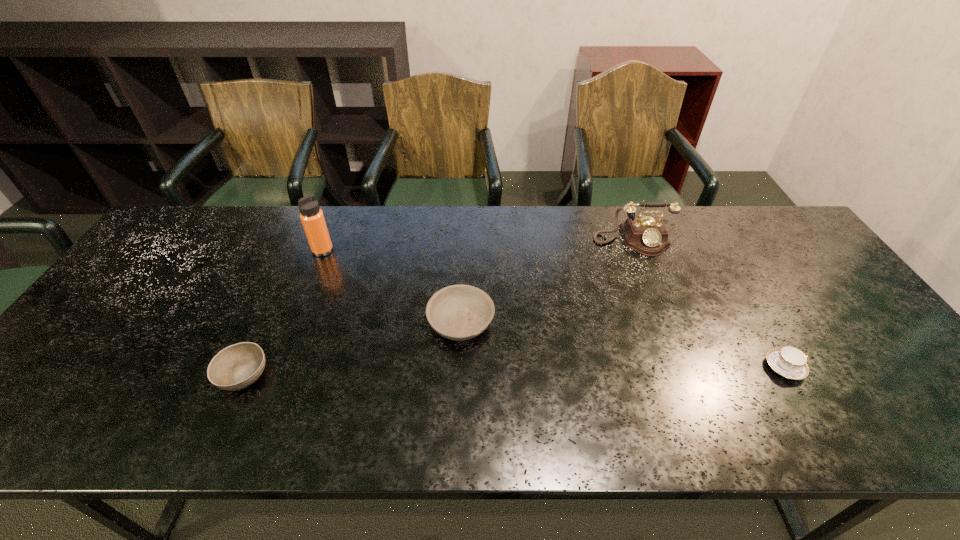
The height and width of the screenshot is (540, 960). I want to click on thermos bottle, so click(312, 218).

Locate an element on the screen. The height and width of the screenshot is (540, 960). the second object from right to left is located at coordinates (647, 235).

Where is `the fourth shortest object`? Image resolution: width=960 pixels, height=540 pixels. the fourth shortest object is located at coordinates (647, 235).

In order to click on the third farthest object in this screenshot , I will do (x=460, y=312).

Where is `the third object from right to left`? Image resolution: width=960 pixels, height=540 pixels. the third object from right to left is located at coordinates (460, 312).

At what (x,y) coordinates should I click in order to perform the action: click on the nearer bowl. Please return your answer as a coordinate pair (x, y). This screenshot has height=540, width=960. Looking at the image, I should click on (236, 367).

Find the location of a particular element. The image size is (960, 540). the rightmost object is located at coordinates (789, 362).

Where is `free space located 0.050m on the front of the thermos bottle`? This screenshot has width=960, height=540. free space located 0.050m on the front of the thermos bottle is located at coordinates (316, 269).

The width and height of the screenshot is (960, 540). Identify the location of vacant region located on the dial of the telephone. (673, 346).

Find the location of a particular element. free region located 0.390m on the right of the right bowl is located at coordinates (645, 322).